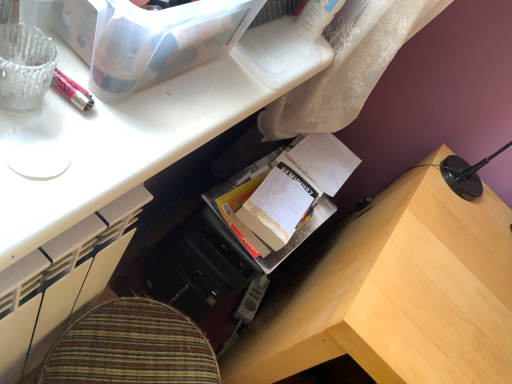
Question: From the image's perspective, would you say wooden desk at lower right is shown under cardboard book at center?

Choices:
 (A) no
 (B) yes

Answer: (B)

Question: Is the position of wooden desk at lower right more distant than that of cardboard book at center?

Choices:
 (A) no
 (B) yes

Answer: (A)

Question: Considering the relative positions of wooden desk at lower right and cardboard book at center in the image provided, is wooden desk at lower right to the right of cardboard book at center from the viewer's perspective?

Choices:
 (A) no
 (B) yes

Answer: (B)

Question: From the image's perspective, is wooden desk at lower right on top of cardboard book at center?

Choices:
 (A) yes
 (B) no

Answer: (B)

Question: Considering the relative positions of wooden desk at lower right and cardboard book at center in the image provided, is wooden desk at lower right to the left of cardboard book at center from the viewer's perspective?

Choices:
 (A) no
 (B) yes

Answer: (A)

Question: Does point (20, 286) appear closer or farther from the camera than point (154, 16)?

Choices:
 (A) closer
 (B) farther

Answer: (B)

Question: In terms of height, does wooden desk at center look taller or shorter compared to transparent plastic storage box at upper left?

Choices:
 (A) tall
 (B) short

Answer: (B)

Question: Is wooden desk at center bigger or smaller than transparent plastic storage box at upper left?

Choices:
 (A) small
 (B) big

Answer: (A)

Question: Would you say wooden desk at center is to the left or to the right of transparent plastic storage box at upper left in the picture?

Choices:
 (A) left
 (B) right

Answer: (B)

Question: Do you think wooden desk at center is within white paper notebook at center, or outside of it?

Choices:
 (A) outside
 (B) inside

Answer: (A)

Question: Does point (284, 39) appear closer or farther from the camera than point (274, 261)?

Choices:
 (A) farther
 (B) closer

Answer: (B)

Question: Would you say wooden desk at center is to the left or to the right of white paper notebook at center in the picture?

Choices:
 (A) left
 (B) right

Answer: (A)

Question: Considering the positions of wooden desk at center and white paper notebook at center in the image, is wooden desk at center bigger or smaller than white paper notebook at center?

Choices:
 (A) small
 (B) big

Answer: (B)

Question: Choose the correct answer: Is wooden desk at lower right inside cardboard book at center or outside it?

Choices:
 (A) outside
 (B) inside

Answer: (A)

Question: Relative to cardboard book at center, is wooden desk at lower right in front or behind?

Choices:
 (A) behind
 (B) front

Answer: (B)